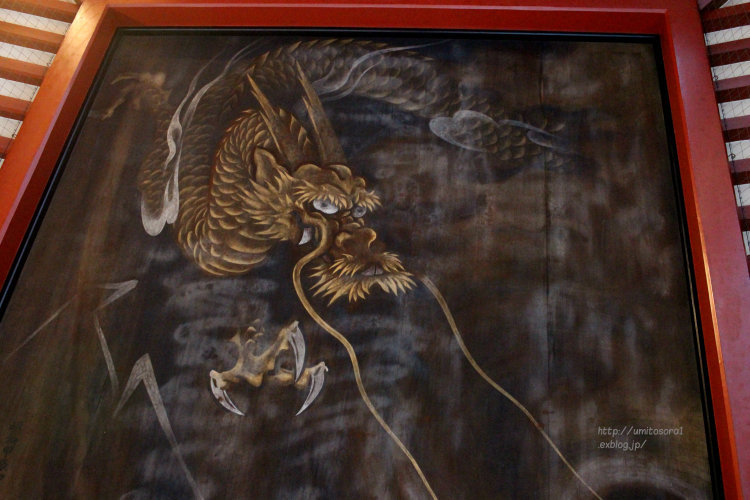
Where is `red frame`? red frame is located at coordinates (45, 120).